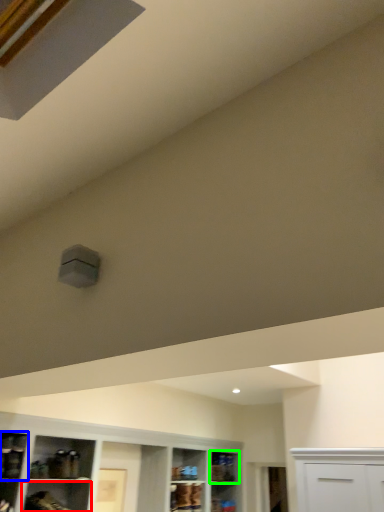
Question: Based on their relative distances, which object is nearer to shelf (highlighted by a red box)? Choose from shelf (highlighted by a blue box) and shelf (highlighted by a green box).

Choices:
 (A) shelf
 (B) shelf

Answer: (A)